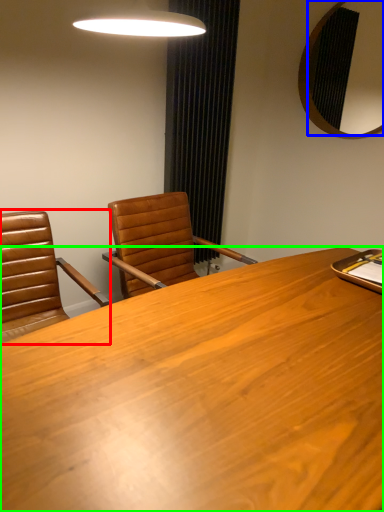
Question: Which object is positioned closest to chair (highlighted by a red box)? Select from mirror (highlighted by a blue box) and desk (highlighted by a green box).

Choices:
 (A) mirror
 (B) desk

Answer: (B)